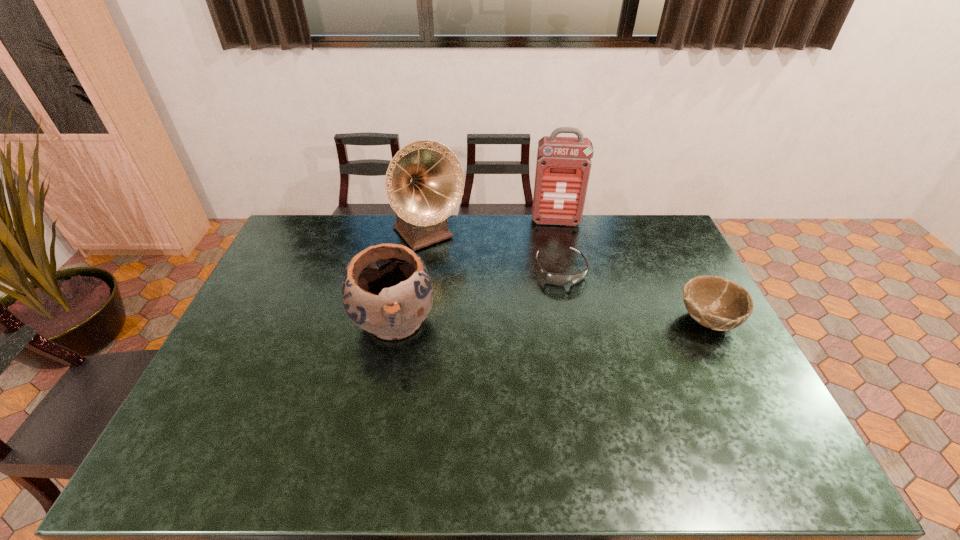
The image size is (960, 540). Identify the location of vacant space positioned on the lenses of the goggles. (575, 301).

At what (x,y) coordinates should I click in order to perform the action: click on blank area located on the front-facing side of the first-aid kit. Please return your answer as a coordinate pair (x, y). The height and width of the screenshot is (540, 960). Looking at the image, I should click on (556, 240).

I want to click on vacant region located 0.130m on the front-facing side of the first-aid kit, so 556,248.

Locate an element on the screen. free space located 0.270m on the front-facing side of the first-aid kit is located at coordinates (558, 273).

The width and height of the screenshot is (960, 540). In order to click on vacant point located 0.310m on the horn of the phonograph record in this screenshot , I will do `click(493, 307)`.

At what (x,y) coordinates should I click in order to perform the action: click on free location located 0.360m on the horn of the phonograph record. Please return your answer as a coordinate pair (x, y). The height and width of the screenshot is (540, 960). Looking at the image, I should click on (503, 318).

What are the coordinates of `vacant space located 0.160m on the horn of the phonograph record` in the screenshot? It's located at (469, 280).

Image resolution: width=960 pixels, height=540 pixels. I want to click on goggles that is at the far edge, so click(557, 279).

This screenshot has width=960, height=540. In order to click on the first-aid kit at the far edge in this screenshot , I will do `click(563, 165)`.

The height and width of the screenshot is (540, 960). Identify the location of phonograph record present at the far edge. (424, 183).